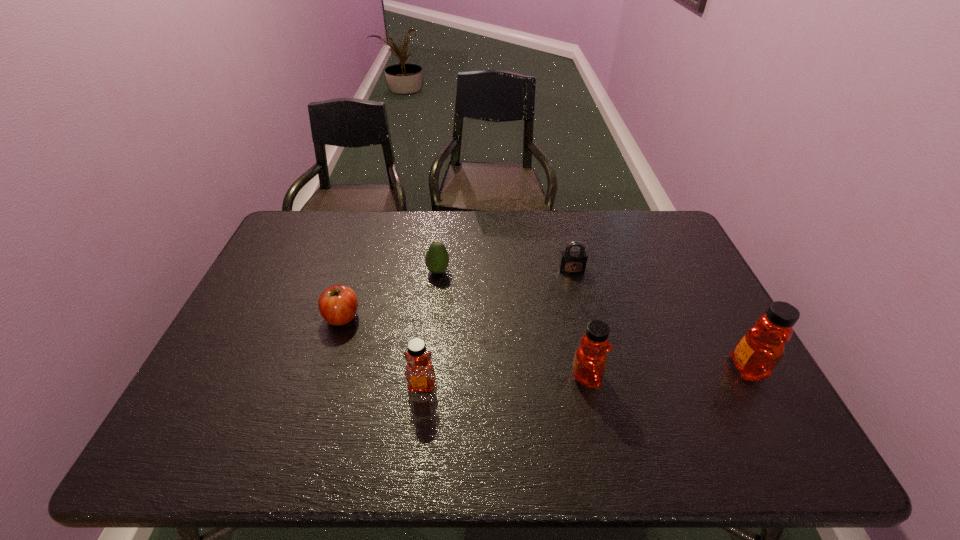
Locate an element on the screen. This screenshot has height=540, width=960. free region at the right edge of the desktop is located at coordinates (706, 347).

Locate an element on the screen. This screenshot has height=540, width=960. free location at the far left corner of the desktop is located at coordinates (302, 210).

This screenshot has width=960, height=540. What are the coordinates of `vacant point at the far right corner` in the screenshot? It's located at (x=676, y=235).

This screenshot has width=960, height=540. In the image, there is a desktop. What are the coordinates of `vacant space at the near right corner` in the screenshot? It's located at (771, 417).

The height and width of the screenshot is (540, 960). In order to click on free spot between the third tallest object and the fourth nearest object in this screenshot , I will do `click(382, 351)`.

In order to click on empty location between the leftmost object and the rightmost object in this screenshot , I will do `click(544, 343)`.

The image size is (960, 540). I want to click on free space between the avocado and the leftmost honey, so click(x=430, y=328).

This screenshot has width=960, height=540. What are the coordinates of `free spot between the third tallest object and the avocado` in the screenshot? It's located at 430,328.

This screenshot has height=540, width=960. In order to click on unoccupied position between the second tallest honey and the shortest honey in this screenshot , I will do `click(504, 381)`.

Locate an element on the screen. Image resolution: width=960 pixels, height=540 pixels. vacant space in between the rightmost object and the avocado is located at coordinates (592, 320).